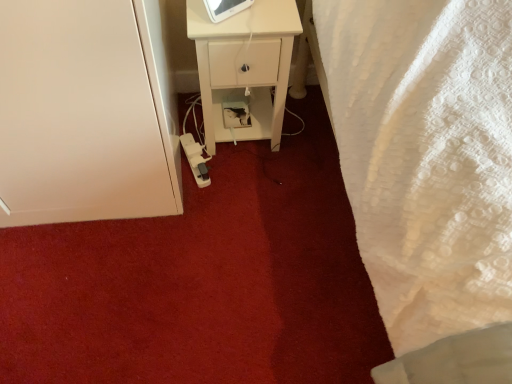
The width and height of the screenshot is (512, 384). Describe the element at coordinates (245, 64) in the screenshot. I see `white wood chest of drawers at center` at that location.

Locate an element on the screen. This screenshot has width=512, height=384. white wood chest of drawers at center is located at coordinates click(x=245, y=64).

The image size is (512, 384). Find the location of `white wood chest of drawers at center`. white wood chest of drawers at center is located at coordinates (245, 64).